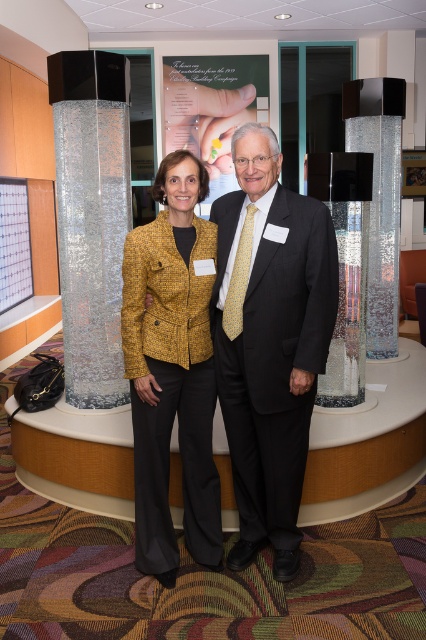
Question: Is yellow textured blazer at center positioned at the back of clear glass cylinder at center?

Choices:
 (A) yes
 (B) no

Answer: (B)

Question: Can you confirm if black suit at center is positioned above sparkly silver column at center?

Choices:
 (A) yes
 (B) no

Answer: (B)

Question: Does black suit at center lie in front of yellow textured blazer at center?

Choices:
 (A) no
 (B) yes

Answer: (B)

Question: Which object is positioned farthest from the sparkly silver column at center?

Choices:
 (A) clear glass cylinder at center
 (B) yellow textured blazer at center

Answer: (A)

Question: Among these objects, which one is nearest to the camera?

Choices:
 (A) sparkly silver column at center
 (B) clear glass cylinder at center

Answer: (A)

Question: Which point is farther to the camera?

Choices:
 (A) (183, 256)
 (B) (330, 392)

Answer: (B)